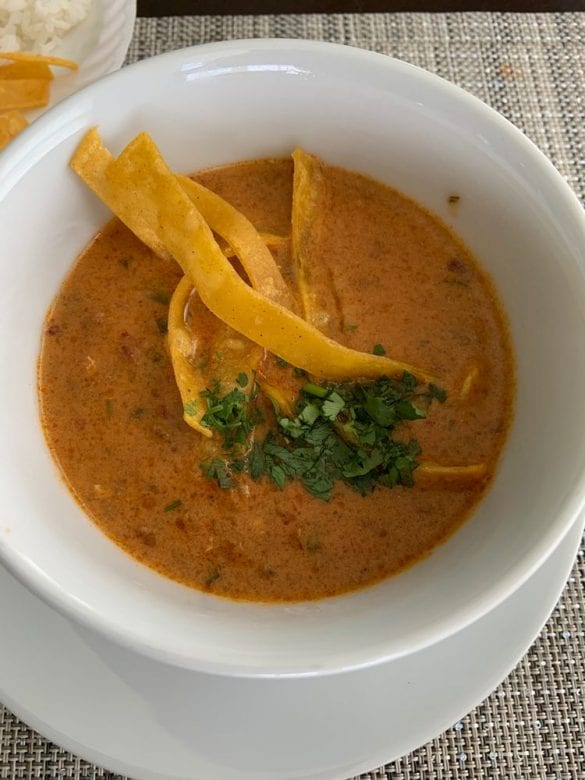
The height and width of the screenshot is (780, 585). What are the coordinates of `ceramic bowl` in the screenshot? It's located at [x=492, y=176].